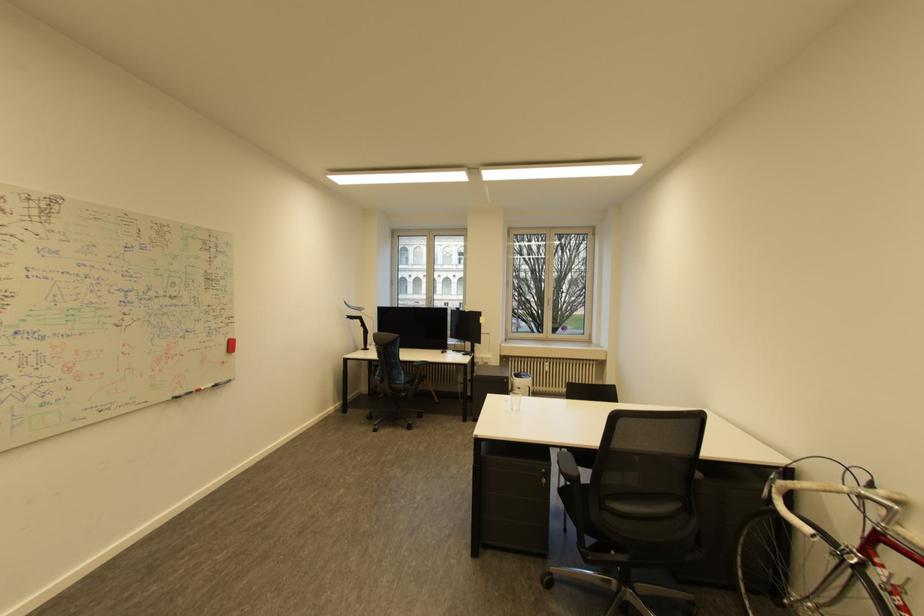
Where is `chair sitting surface`? This screenshot has height=616, width=924. chair sitting surface is located at coordinates (623, 496).